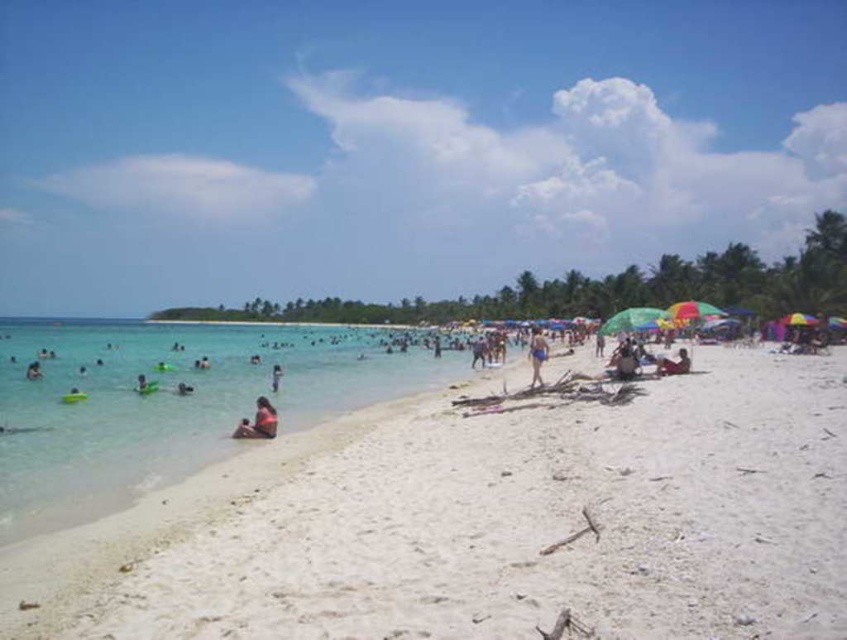
Between white sand beach at center and tan skin person at center, which one is positioned higher?

tan skin person at center is above.

Who is taller, white sand beach at center or tan skin person at center?

With more height is white sand beach at center.

This screenshot has height=640, width=847. I want to click on white sand beach at center, so click(486, 524).

Is purple fabric bikini at center smaller than green plastic float at left?

No.

The height and width of the screenshot is (640, 847). What do you see at coordinates (535, 355) in the screenshot? I see `purple fabric bikini at center` at bounding box center [535, 355].

Where is `purple fabric bikini at center`? purple fabric bikini at center is located at coordinates (535, 355).

Who is positioned more to the left, white sand beach at center or dark brown skin at lower right?

Positioned to the left is white sand beach at center.

The width and height of the screenshot is (847, 640). What do you see at coordinates (486, 524) in the screenshot?
I see `white sand beach at center` at bounding box center [486, 524].

Looking at this image, measure the distance between point (358, 438) and camera.

Point (358, 438) and camera are 137.71 meters apart from each other.

This screenshot has width=847, height=640. In order to click on white sand beach at center in this screenshot , I will do `click(486, 524)`.